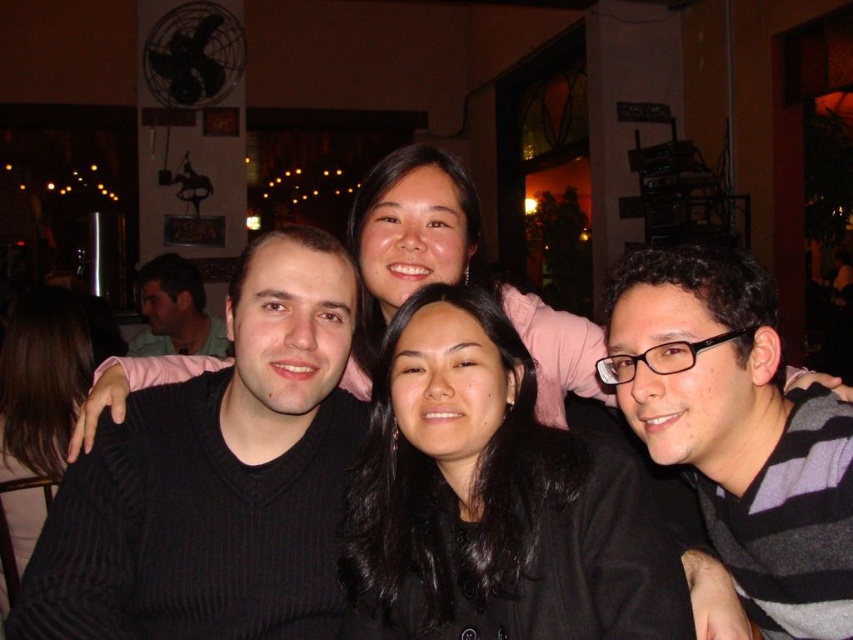
Which is above, black ribbed sweater at left or striped sweater at center?

striped sweater at center is above.

Between black ribbed sweater at left and striped sweater at center, which one has more height?

black ribbed sweater at left

Who is more forward, (21, 612) or (704, 378)?

Point (704, 378) is in front.

At what (x,y) coordinates should I click in order to perform the action: click on black ribbed sweater at left. Please return your answer as a coordinate pair (x, y). Looking at the image, I should click on (218, 477).

Is point (714, 444) farther from camera compared to point (13, 337)?

No, (714, 444) is closer to viewer.

Is striped sweater at center behind dark brown hair at lower left?

That is False.

Is point (698, 289) less distant than point (54, 419)?

Yes, it is.

The width and height of the screenshot is (853, 640). I want to click on striped sweater at center, so click(x=740, y=432).

Is black ribbed sweater at left further to camera compared to matte white shirt at upper left?

No, it is in front of matte white shirt at upper left.

Is black ribbed sweater at left smaller than matte white shirt at upper left?

Yes.

Where is `black ribbed sweater at left`? This screenshot has height=640, width=853. black ribbed sweater at left is located at coordinates (218, 477).